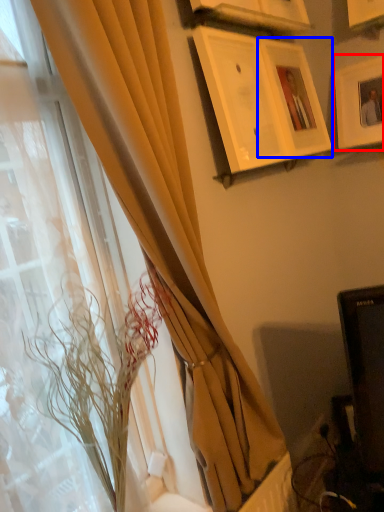
Question: Which object is further to the camera taking this photo, picture frame (highlighted by a red box) or picture frame (highlighted by a blue box)?

Choices:
 (A) picture frame
 (B) picture frame

Answer: (A)